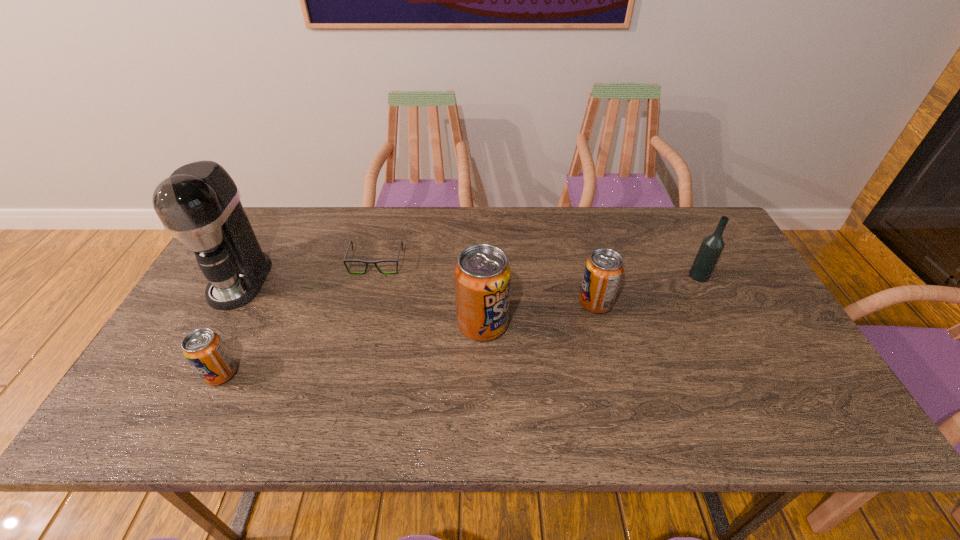
Locate an element on the screen. The width and height of the screenshot is (960, 540). the leftmost soda can is located at coordinates (204, 349).

The width and height of the screenshot is (960, 540). Find the location of `the shortest soda can`. the shortest soda can is located at coordinates (204, 349).

Identify the location of the third object from right to left. (482, 276).

Where is `the second soda can from left to right`? The width and height of the screenshot is (960, 540). the second soda can from left to right is located at coordinates (482, 276).

You are a GUI agent. You are given a task and a screenshot of the screen. Output one action in this format:
    pyautogui.click(x=<x>, y=<y>)
    Task: Click on the fourth tallest object
    
    Given the screenshot: What is the action you would take?
    pyautogui.click(x=603, y=271)

Where is `the second shortest soda can`? The image size is (960, 540). the second shortest soda can is located at coordinates (603, 271).

Image resolution: width=960 pixels, height=540 pixels. In order to click on the tallest object in this screenshot , I will do `click(199, 204)`.

The image size is (960, 540). I want to click on the rightmost object, so tap(712, 246).

Where is `the shortest object`? the shortest object is located at coordinates (349, 260).

Where is `the fourth object from right to left`? the fourth object from right to left is located at coordinates (349, 260).